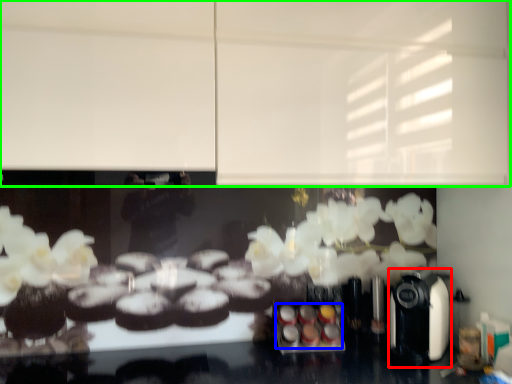
Question: Which is farther away from coffee machine (highlighted by a red box)? food (highlighted by a blue box) or backdrop (highlighted by a green box)?

Choices:
 (A) food
 (B) backdrop

Answer: (B)